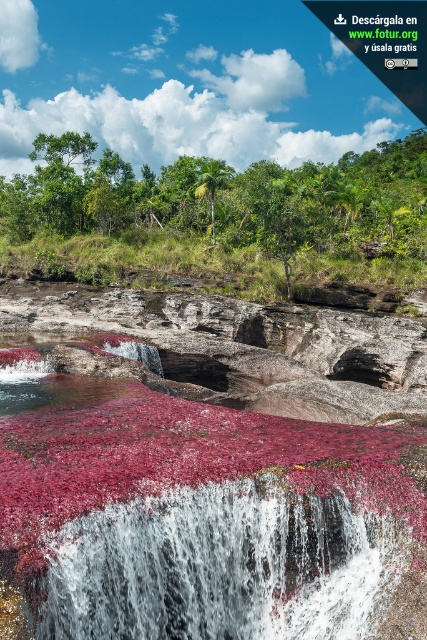
Is the position of white frothy water at center more distant than that of green leafy trees at center?

No.

You are a GUI agent. You are given a task and a screenshot of the screen. Output one action in this format:
    pyautogui.click(x=<x>, y=<y>)
    Task: Click on the white frothy water at center
    The width and height of the screenshot is (427, 640).
    Given the screenshot: What is the action you would take?
    pyautogui.click(x=219, y=566)

Is point (327, 554) farther from camera compared to point (409, 202)?

That is False.

Find the location of `white frothy water at center`. white frothy water at center is located at coordinates (219, 566).